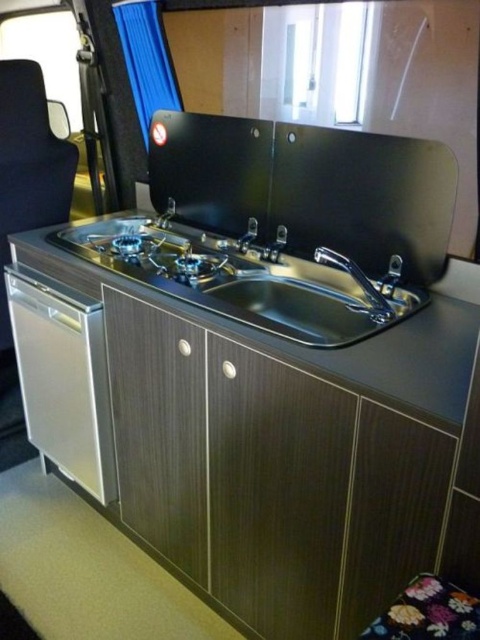
Question: Among these objects, which one is farthest from the camera?

Choices:
 (A) satin nickel faucet at center
 (B) satin black countertop at center
 (C) floral fabric stool at lower right
 (D) stainless steel gas stove at center

Answer: (A)

Question: Considering the real-world distances, which object is farthest from the satin nickel faucet at center?

Choices:
 (A) satin black countertop at center
 (B) satin silver oven at lower left

Answer: (A)

Question: Is satin black countertop at center further to the viewer compared to floral fabric stool at lower right?

Choices:
 (A) yes
 (B) no

Answer: (A)

Question: Which point appears farthest from the camera in this image?

Choices:
 (A) (29, 269)
 (B) (445, 592)
 (C) (245, 275)

Answer: (A)

Question: Can you confirm if satin black countertop at center is thinner than floral fabric stool at lower right?

Choices:
 (A) yes
 (B) no

Answer: (B)

Question: Can you confirm if floral fabric stool at lower right is thinner than polished stainless steel faucet at center?

Choices:
 (A) yes
 (B) no

Answer: (B)